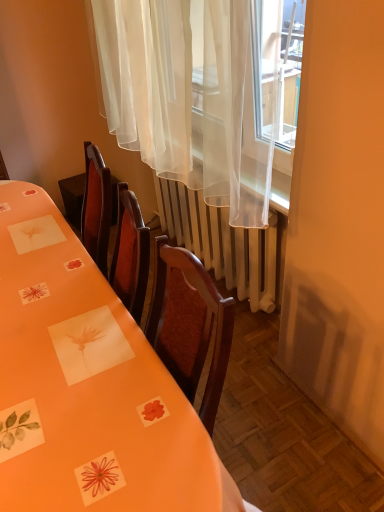
Image resolution: width=384 pixels, height=512 pixels. Identify the location of orange paper table at center. (87, 386).

Describe the element at coordinates (87, 386) in the screenshot. This screenshot has height=512, width=384. I see `orange paper table at center` at that location.

Where is `orange paper table at center`? orange paper table at center is located at coordinates (87, 386).

Can you confirm if white metallic radiator at center is thinner than sheer white curtain at upper center?

Yes, white metallic radiator at center is thinner than sheer white curtain at upper center.

Do you think white metallic radiator at center is within sheer white curtain at upper center, or outside of it?

The correct answer is: outside.

Does white metallic radiator at center have a smaller size compared to sheer white curtain at upper center?

Indeed, white metallic radiator at center has a smaller size compared to sheer white curtain at upper center.

Considering the positions of objects sheer white curtain at upper center and orange paper table at center in the image provided, who is more to the right, sheer white curtain at upper center or orange paper table at center?

From the viewer's perspective, sheer white curtain at upper center appears more on the right side.

From the image's perspective, would you say sheer white curtain at upper center is shown under orange paper table at center?

Actually, sheer white curtain at upper center appears above orange paper table at center in the image.

From the picture: Who is smaller, sheer white curtain at upper center or orange paper table at center?

With smaller size is orange paper table at center.

From the picture: Measure the distance between sheer white curtain at upper center and orange paper table at center.

They are 27.13 inches apart.

At what (x,y) coordinates should I click in order to perform the action: click on table above the white metallic radiator at center (from a real-world perspective). Please return your answer as a coordinate pair (x, y). This screenshot has width=384, height=512. Looking at the image, I should click on (87, 386).

From the image's perspective, which one is positioned lower, orange paper table at center or white metallic radiator at center?

orange paper table at center is shown below in the image.

Does point (14, 414) lie behind point (181, 226)?

No, it is not.

How many degrees apart are the facing directions of orange paper table at center and white metallic radiator at center?

0.45 degrees.

From the image's perspective, which is above, white metallic radiator at center or orange paper table at center?

white metallic radiator at center is shown above in the image.

Does point (195, 245) come in front of point (168, 482)?

No, it is behind (168, 482).

Measure the distance from white metallic radiator at center to orange paper table at center.

35.27 inches.

Is white metallic radiator at center beside orange paper table at center?

No, white metallic radiator at center is not making contact with orange paper table at center.

Is sheer white curtain at upper center outside of white metallic radiator at center?

sheer white curtain at upper center lies outside white metallic radiator at center's area.

From the image's perspective, between sheer white curtain at upper center and white metallic radiator at center, who is located below?

white metallic radiator at center.

In the image, is sheer white curtain at upper center on the left side or the right side of white metallic radiator at center?

In the image, sheer white curtain at upper center appears on the left side of white metallic radiator at center.

Looking at this image, is sheer white curtain at upper center facing towards white metallic radiator at center?

No.

Is sheer white curtain at upper center at the back of orange paper table at center?

That's not correct — orange paper table at center is not looking away from sheer white curtain at upper center.

In terms of size, does orange paper table at center appear bigger or smaller than sheer white curtain at upper center?

In the image, orange paper table at center appears to be smaller than sheer white curtain at upper center.

Looking at this image, from the image's perspective, between orange paper table at center and sheer white curtain at upper center, who is located below?

orange paper table at center, from the image's perspective.

Where is `radiator located behind the sheer white curtain at upper center`? radiator located behind the sheer white curtain at upper center is located at coordinates (221, 242).

Where is `table below the sheer white curtain at upper center (from the image's perspective)`? table below the sheer white curtain at upper center (from the image's perspective) is located at coordinates pos(87,386).

Looking at the image, which one is located further to white metallic radiator at center, orange paper table at center or sheer white curtain at upper center?

The object further to white metallic radiator at center is orange paper table at center.

Which object lies nearer to the anchor point white metallic radiator at center, sheer white curtain at upper center or orange paper table at center?

sheer white curtain at upper center.

When comparing their distances from sheer white curtain at upper center, does orange paper table at center or white metallic radiator at center seem further?

Based on the image, orange paper table at center appears to be further to sheer white curtain at upper center.

When comparing their distances from orange paper table at center, does sheer white curtain at upper center or white metallic radiator at center seem further?

white metallic radiator at center lies further to orange paper table at center than the other object.

Estimate the real-world distances between objects in this image. Which object is closer to orange paper table at center, white metallic radiator at center or sheer white curtain at upper center?

sheer white curtain at upper center.

Estimate the real-world distances between objects in this image. Which object is closer to sheer white curtain at upper center, white metallic radiator at center or orange paper table at center?

white metallic radiator at center is closer to sheer white curtain at upper center.

The width and height of the screenshot is (384, 512). Identify the location of radiator that lies between sheer white curtain at upper center and orange paper table at center from top to bottom. (221, 242).